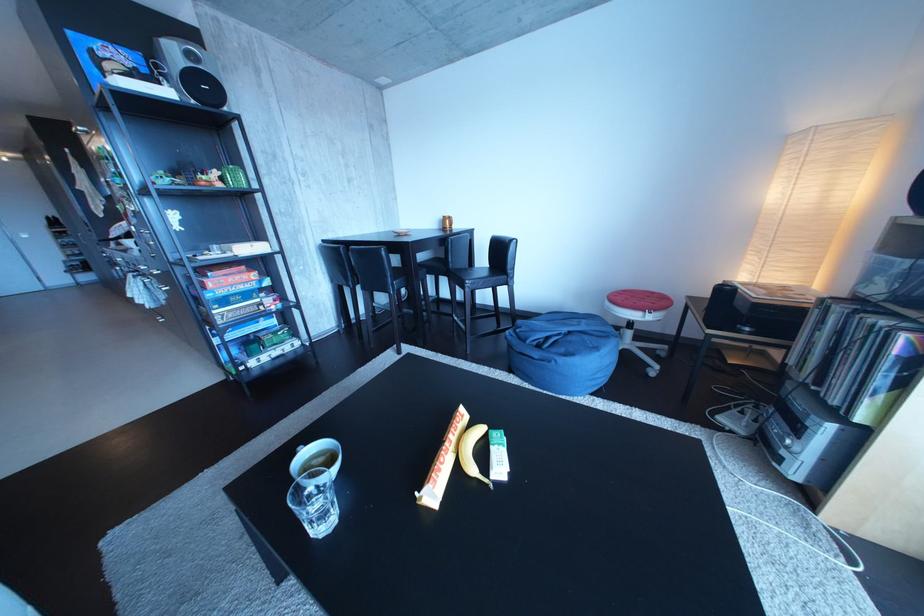
The location [443,461] corresponds to which object?

It refers to a yellow candy box.